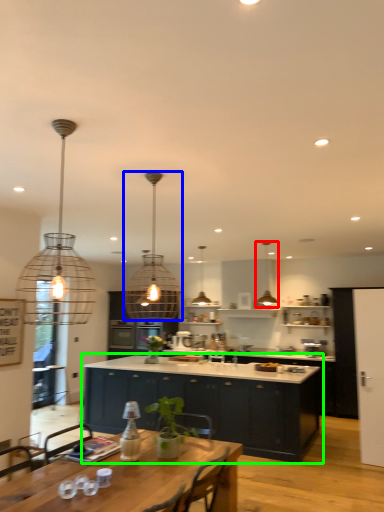
Question: Which object is the closest to the lamp (highlighted by a red box)? Choose among these: lamp (highlighted by a blue box) or cabinetry (highlighted by a green box).

Choices:
 (A) lamp
 (B) cabinetry

Answer: (A)